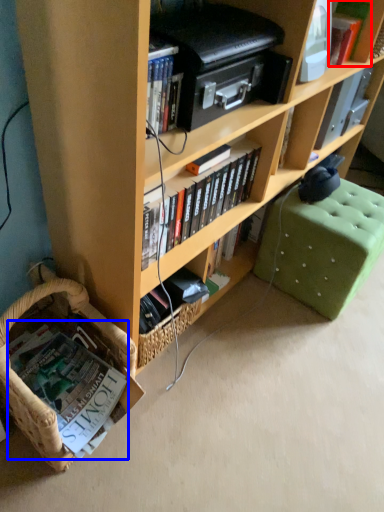
Question: Among these objects, which one is farthest to the camera, book (highlighted by a red box) or book (highlighted by a blue box)?

Choices:
 (A) book
 (B) book

Answer: (A)